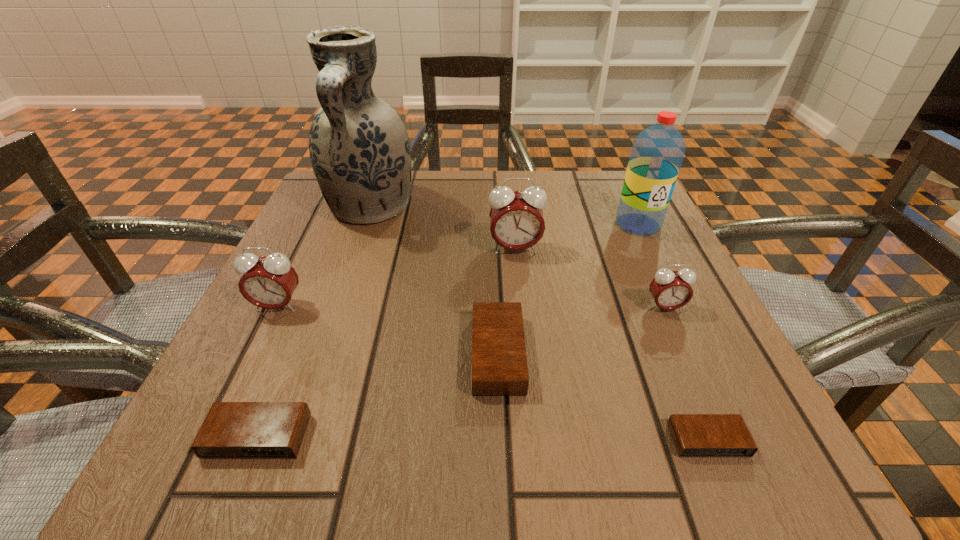
Where is `free space that is in between the third tallest alarm clock and the second tallest object`? The width and height of the screenshot is (960, 540). free space that is in between the third tallest alarm clock and the second tallest object is located at coordinates (651, 266).

I want to click on free space between the water bottle and the rightmost pink alarm clock, so click(x=651, y=266).

At what (x,y) coordinates should I click in order to perform the action: click on free space between the red water bottle and the sixth tallest object. Please return your answer as a coordinate pair (x, y). This screenshot has height=540, width=960. Looking at the image, I should click on (568, 289).

This screenshot has width=960, height=540. I want to click on vacant point located between the shortest alarm clock and the third nearest object, so pyautogui.click(x=603, y=397).

Where is `vacant space in between the second pink alarm clock from right to left and the fourth tallest object`? vacant space in between the second pink alarm clock from right to left and the fourth tallest object is located at coordinates 396,277.

Where is `free spot between the rightmost pink alarm clock and the tallest object`? The image size is (960, 540). free spot between the rightmost pink alarm clock and the tallest object is located at coordinates (517, 258).

Where is `vacant space in between the blue vase and the leftmost black alarm clock`? The width and height of the screenshot is (960, 540). vacant space in between the blue vase and the leftmost black alarm clock is located at coordinates (314, 322).

Locate which object is the sixth closest to the red water bottle. Please provide its 2D coordinates. Your answer should be formatted as a tuple, i.e. [(x, y)], where the tuple contains the x and y coordinates of a point satisfying the conditions above.

[(268, 282)]

Select which object appears as the sixth closest to the shortest alarm clock. Please provide its 2D coordinates. Your answer should be formatted as a tuple, i.e. [(x, y)], where the tuple contains the x and y coordinates of a point satisfying the conditions above.

[(359, 147)]

Where is `alarm clock object that ranks as the fifth closest to the second pink alarm clock from left to right`? The image size is (960, 540). alarm clock object that ranks as the fifth closest to the second pink alarm clock from left to right is located at coordinates (231, 430).